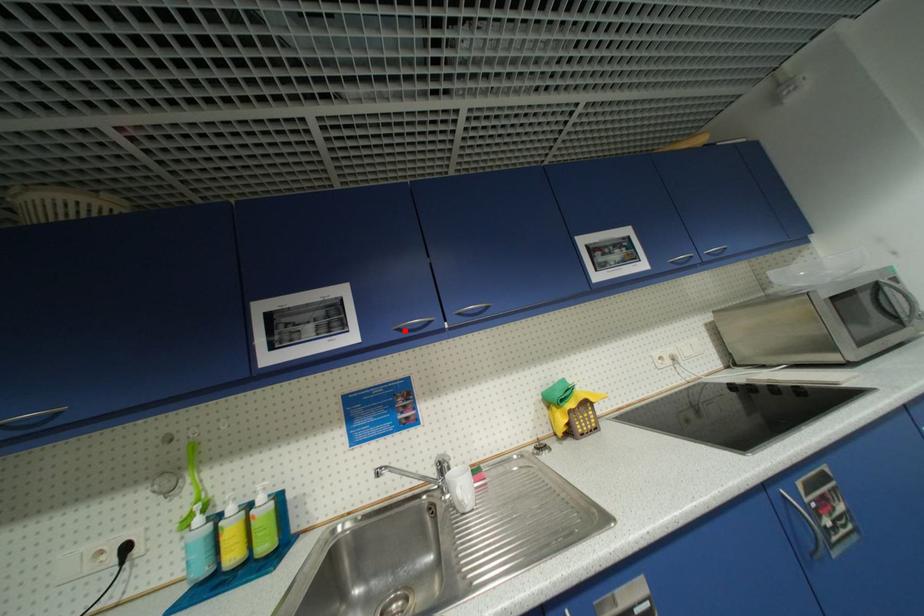
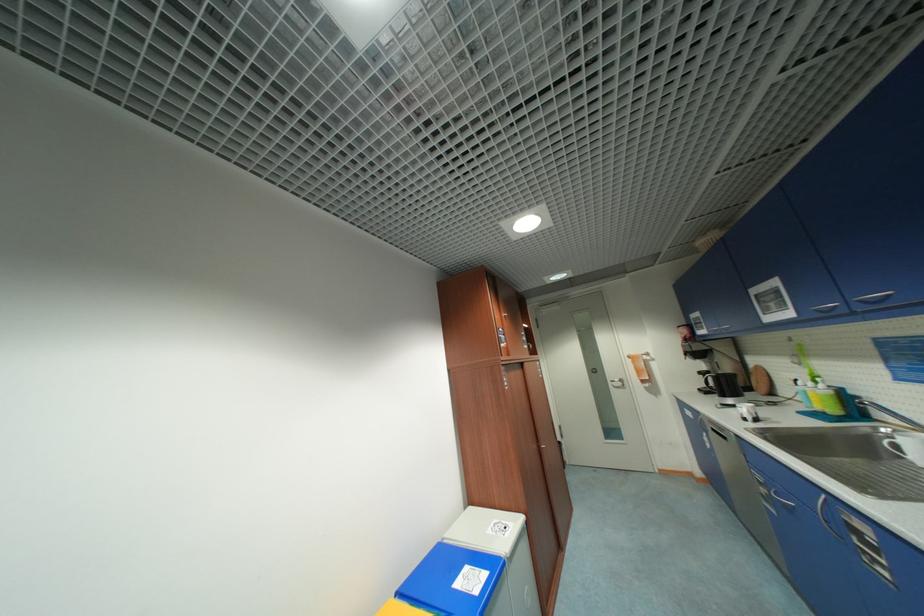
In the second image, find the point that corresponds to the highlighted location in the first image.

(822, 312)